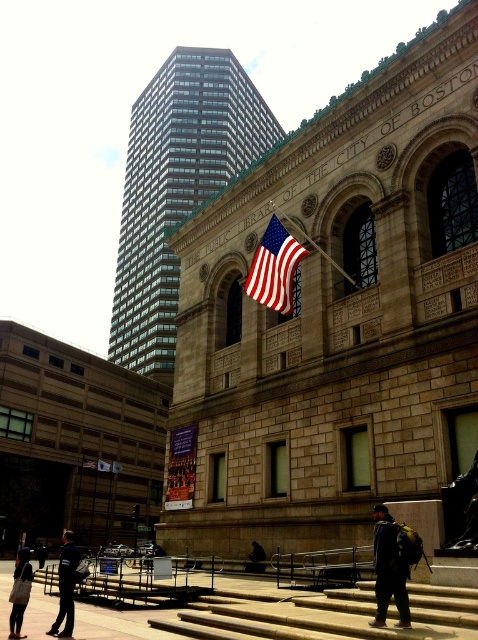
You are standing in front of the Public Library of the City of Boston. There are two points marked on the building facade. The first point is at coordinate point (x=264, y=264) and the second point is at coordinate point (x=75, y=570). Which point is closer to you?

Point (x=264, y=264) is closer to you because it is further to the viewer than point (x=75, y=570).